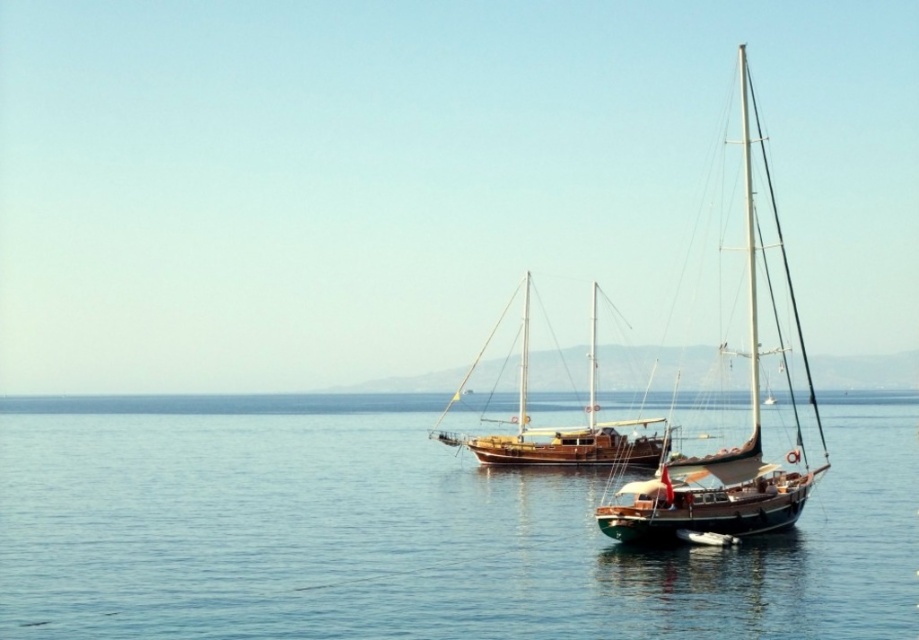
Does blue water at center have a greater width compared to brown wooden sailboat at center?

Yes.

Who is positioned more to the right, blue water at center or brown wooden sailboat at center?

blue water at center

Locate an element on the screen. The height and width of the screenshot is (640, 919). blue water at center is located at coordinates (415, 538).

Find the location of `blue water at center`. blue water at center is located at coordinates (415, 538).

Does blue water at center have a larger size compared to wooden sailboat at right?

Incorrect, blue water at center is not larger than wooden sailboat at right.

Who is lower down, blue water at center or wooden sailboat at right?

blue water at center is below.

Which is behind, point (154, 435) or point (715, 486)?

Point (154, 435)

The width and height of the screenshot is (919, 640). I want to click on blue water at center, so click(415, 538).

Which of these two, wooden sailboat at right or brown wooden sailboat at center, stands shorter?

brown wooden sailboat at center

Does point (633, 518) lie in front of point (526, 456)?

That is True.

Does point (674, 515) come closer to viewer compared to point (577, 433)?

Yes, it is.

This screenshot has width=919, height=640. Identify the location of wooden sailboat at right. (730, 448).